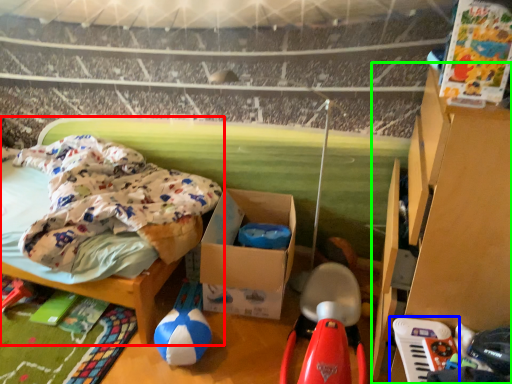
Question: Estimate the real-world distances between objects in this image. Which object is closer to furniture (highlighted by a red box), toy (highlighted by a blue box) or furniture (highlighted by a green box)?

Choices:
 (A) toy
 (B) furniture

Answer: (B)